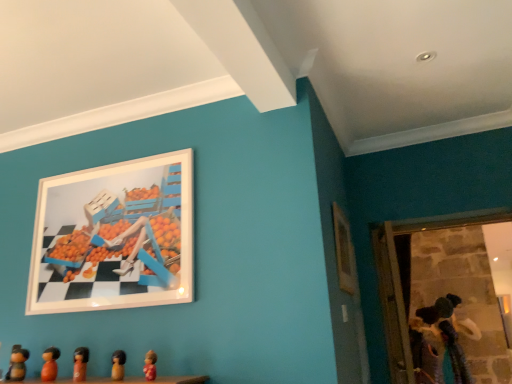
I want to click on free space to the back side of matte orange figurine at lower left, the 4th toy when ordered from right to left, so click(x=83, y=378).